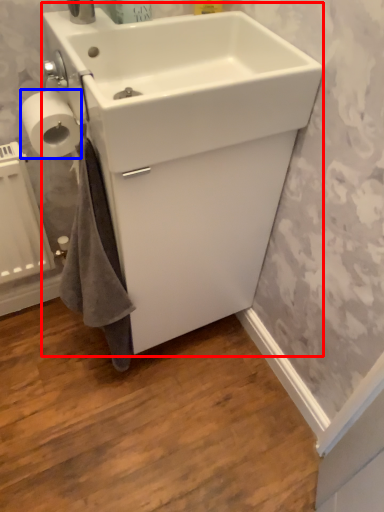
Question: Which point is closer to the camera, sink (highlighted by a red box) or toilet paper (highlighted by a blue box)?

Choices:
 (A) sink
 (B) toilet paper

Answer: (A)